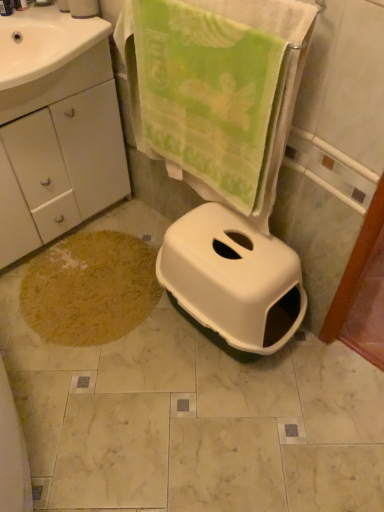
Question: Should I look upward or downward to see yellow textured bath mat at lower left?

Choices:
 (A) down
 (B) up

Answer: (A)

Question: Is white matte cabinet at lower left in contact with white glossy sink at upper left?

Choices:
 (A) no
 (B) yes

Answer: (A)

Question: From a real-world perspective, is white matte cabinet at lower left physically above white glossy sink at upper left?

Choices:
 (A) yes
 (B) no

Answer: (B)

Question: Does white matte cabinet at lower left turn towards white glossy sink at upper left?

Choices:
 (A) yes
 (B) no

Answer: (B)

Question: Does white matte cabinet at lower left have a greater width compared to white glossy sink at upper left?

Choices:
 (A) yes
 (B) no

Answer: (B)

Question: Is white matte cabinet at lower left facing away from white glossy sink at upper left?

Choices:
 (A) no
 (B) yes

Answer: (A)

Question: Can you confirm if white matte cabinet at lower left is thinner than white glossy sink at upper left?

Choices:
 (A) no
 (B) yes

Answer: (B)

Question: Is the depth of white glossy sink at upper left less than that of white matte cabinet at lower left?

Choices:
 (A) no
 (B) yes

Answer: (B)

Question: Considering the relative sizes of white glossy sink at upper left and white matte cabinet at lower left in the image provided, is white glossy sink at upper left shorter than white matte cabinet at lower left?

Choices:
 (A) yes
 (B) no

Answer: (A)

Question: Would you say white glossy sink at upper left is a long distance from white matte cabinet at lower left?

Choices:
 (A) yes
 (B) no

Answer: (B)

Question: Can you confirm if white glossy sink at upper left is positioned to the right of white matte cabinet at lower left?

Choices:
 (A) yes
 (B) no

Answer: (A)

Question: Considering the relative sizes of white glossy sink at upper left and white matte cabinet at lower left in the image provided, is white glossy sink at upper left bigger than white matte cabinet at lower left?

Choices:
 (A) yes
 (B) no

Answer: (B)

Question: From the image's perspective, is white glossy sink at upper left under white matte cabinet at lower left?

Choices:
 (A) yes
 (B) no

Answer: (B)

Question: Is yellow textured bath mat at lower left smaller than white plastic toilet at center?

Choices:
 (A) yes
 (B) no

Answer: (A)